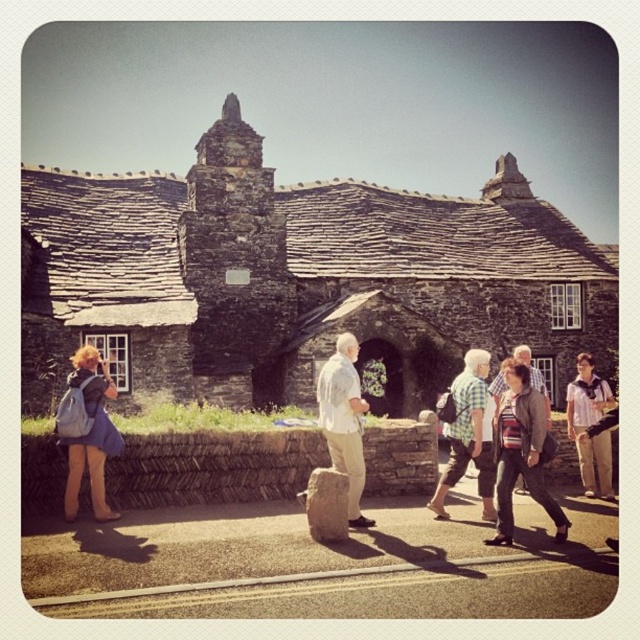
Question: Does white cotton shirt at center have a smaller size compared to denim jacket at lower left?

Choices:
 (A) yes
 (B) no

Answer: (B)

Question: Which of these objects is positioned farthest from the striped knit sweater at center?

Choices:
 (A) denim jacket at lower left
 (B) checkered fabric shirt at center
 (C) light brown fabric shirt at lower right

Answer: (A)

Question: Is denim jacket at lower left wider than light brown fabric shirt at lower right?

Choices:
 (A) yes
 (B) no

Answer: (B)

Question: Considering the real-world distances, which object is farthest from the denim jacket at lower left?

Choices:
 (A) checkered fabric shirt at center
 (B) striped knit sweater at center

Answer: (B)

Question: Is checkered fabric shirt at center thinner than light brown fabric shirt at lower right?

Choices:
 (A) no
 (B) yes

Answer: (B)

Question: Which point is closer to the camera?

Choices:
 (A) (458, 440)
 (B) (497, 433)
 (C) (339, 497)

Answer: (C)